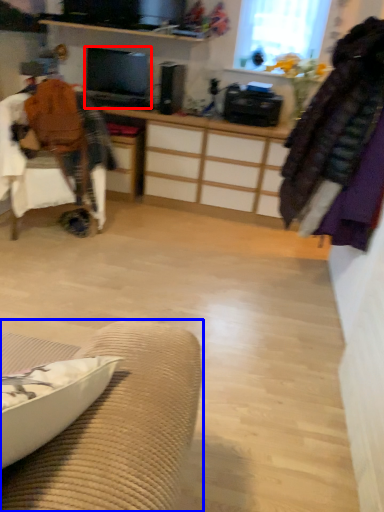
Question: Among these objects, which one is farthest to the camera, television (highlighted by a red box) or furniture (highlighted by a blue box)?

Choices:
 (A) television
 (B) furniture

Answer: (A)